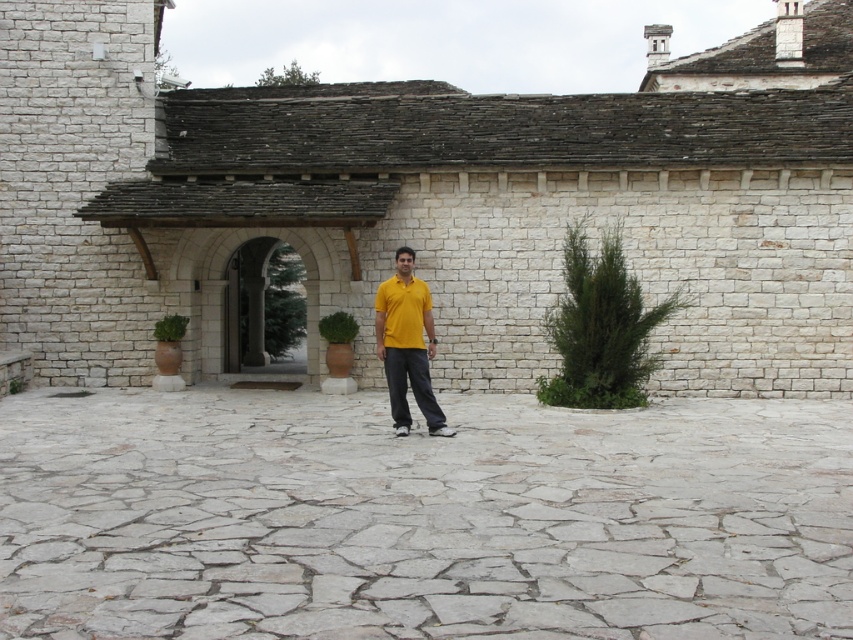
Between point (651, 419) and point (422, 364), which one is positioned behind?

Positioned behind is point (651, 419).

Does gray stone courtyard at center appear on the left side of yellow matte shirt at center?

In fact, gray stone courtyard at center is to the right of yellow matte shirt at center.

Measure the distance between gray stone courtyard at center and camera.

gray stone courtyard at center is 4.58 meters away from camera.

At what (x,y) coordinates should I click in order to perform the action: click on gray stone courtyard at center. Please return your answer as a coordinate pair (x, y). Image resolution: width=853 pixels, height=640 pixels. Looking at the image, I should click on (421, 516).